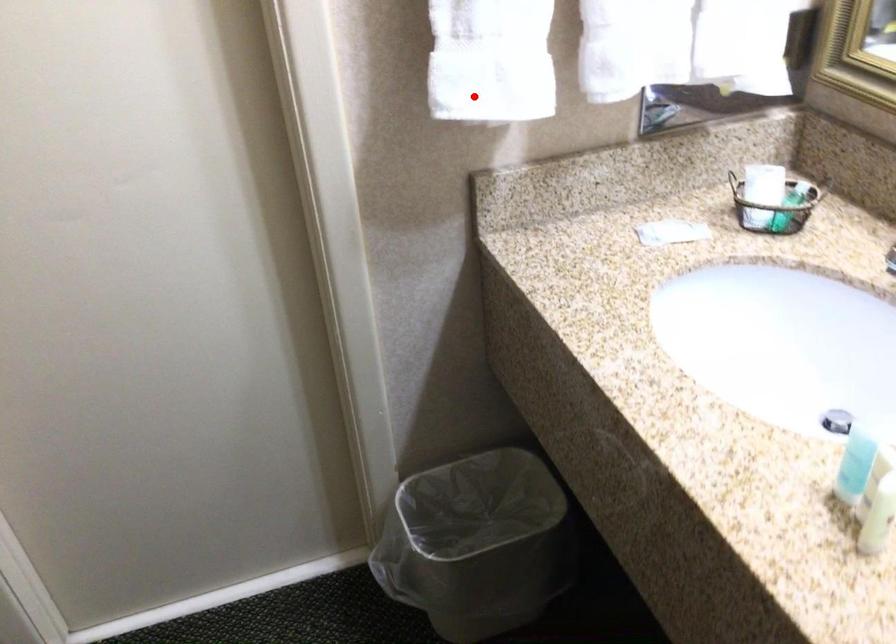
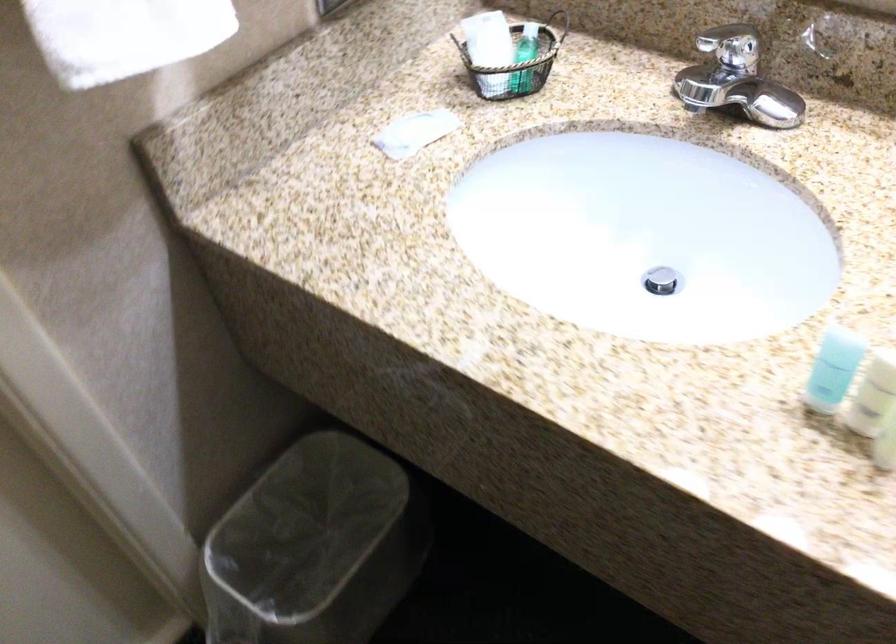
Question: I am providing you with two images of the same scene from different viewpoints. In image1, a red point is highlighted. Considering the same 3D point in image2, which of the following is correct?

Choices:
 (A) It is closer
 (B) It is farther

Answer: (A)